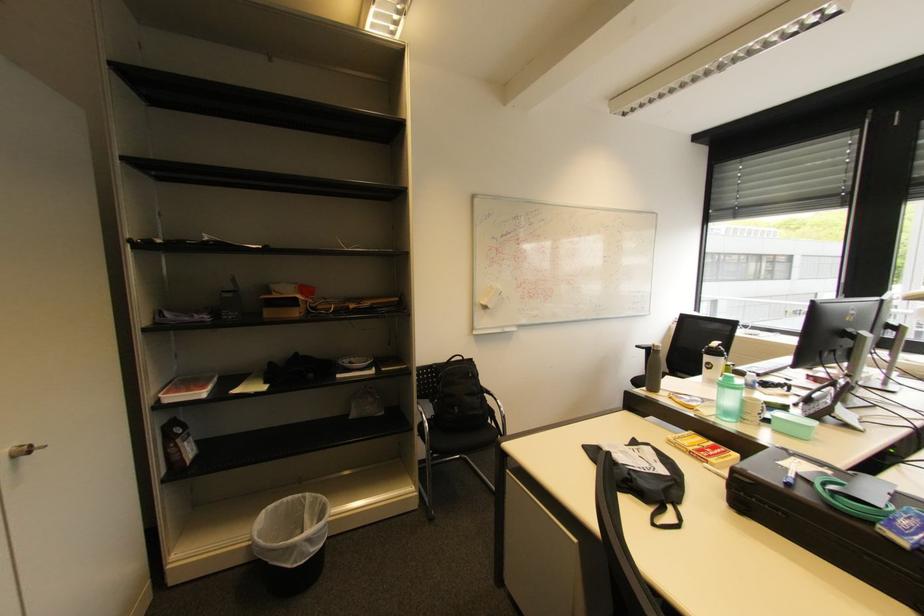
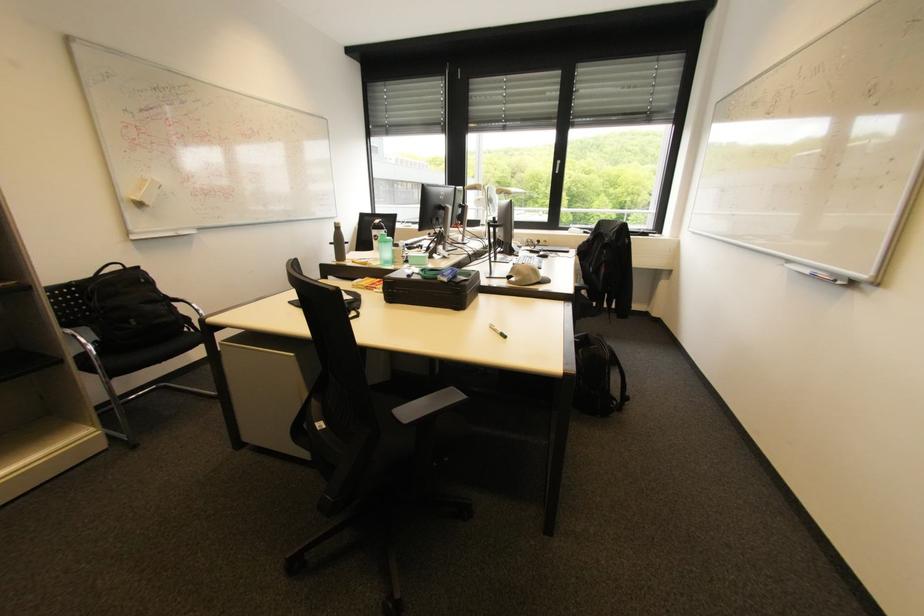
The point at (426,410) is marked in the first image. Where is the corresponding point in the second image?

(74, 331)